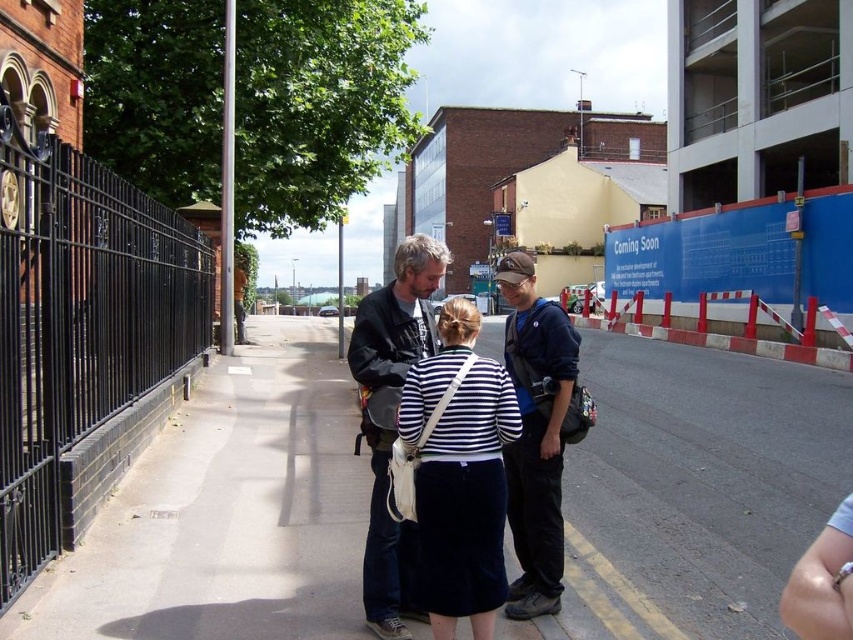
Question: Which of the following is the farthest from the observer?

Choices:
 (A) (357, 381)
 (B) (503, 285)

Answer: (A)

Question: Can you confirm if black wrought iron fence at left is bigger than white striped shirt at center?

Choices:
 (A) yes
 (B) no

Answer: (B)

Question: Is concrete sidewalk at center smaller than black wrought iron fence at left?

Choices:
 (A) no
 (B) yes

Answer: (A)

Question: Based on their relative distances, which object is farther from the concrete sidewalk at center?

Choices:
 (A) red plastic barricade at right
 (B) black wrought iron fence at left

Answer: (B)

Question: Is black wrought iron fence at left above white striped shirt at center?

Choices:
 (A) yes
 (B) no

Answer: (A)

Question: Considering the real-world distances, which object is farthest from the red plastic barricade at right?

Choices:
 (A) concrete sidewalk at center
 (B) white striped shirt at center
 (C) black wrought iron fence at left
 (D) dark blue fabric jacket at center

Answer: (C)